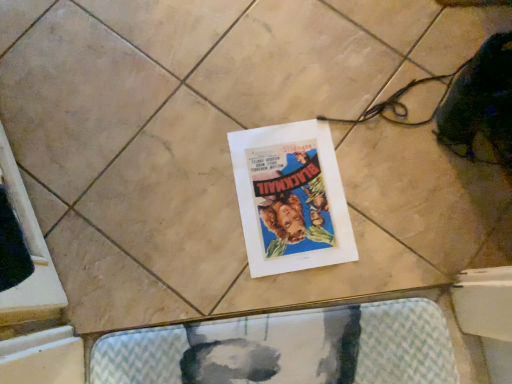
Where is `matte paper comic book at center`? matte paper comic book at center is located at coordinates (291, 198).

What do you see at coordinates (291, 198) in the screenshot?
I see `matte paper comic book at center` at bounding box center [291, 198].

Locate an element on the screen. matte paper comic book at center is located at coordinates (x=291, y=198).